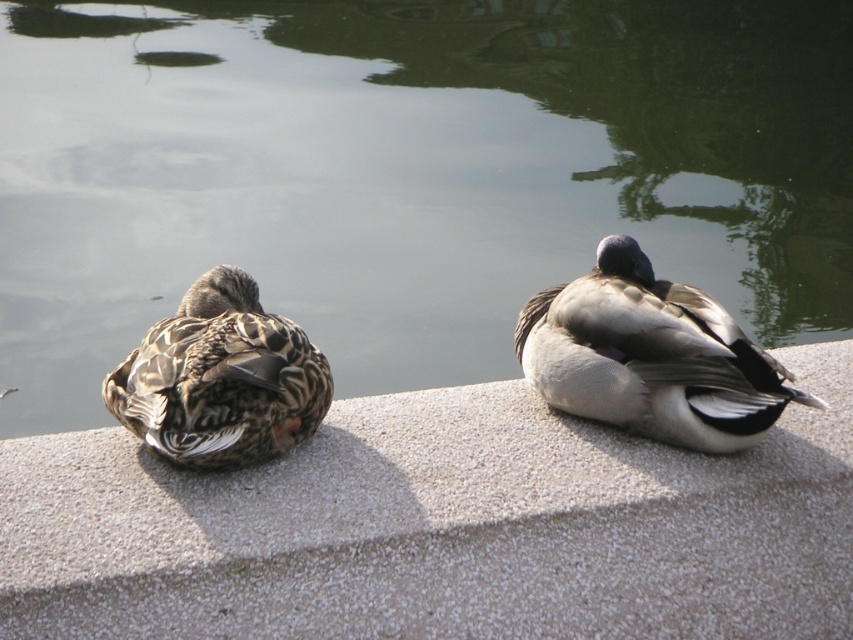
Based on the photo, does green smooth water at center have a smaller size compared to gray textured concrete at center?

Correct, green smooth water at center occupies less space than gray textured concrete at center.

Does green smooth water at center appear under gray textured concrete at center?

Actually, green smooth water at center is above gray textured concrete at center.

Identify the location of green smooth water at center. Image resolution: width=853 pixels, height=640 pixels. (407, 172).

The width and height of the screenshot is (853, 640). Find the location of `green smooth water at center`. green smooth water at center is located at coordinates (407, 172).

Between green smooth water at center and gray matte duck at center, which one is positioned lower?

green smooth water at center

Measure the distance between green smooth water at center and gray matte duck at center.

8.70 feet

Where is `green smooth water at center`? green smooth water at center is located at coordinates (407, 172).

At what (x,y) coordinates should I click in order to perform the action: click on green smooth water at center. Please return your answer as a coordinate pair (x, y). Looking at the image, I should click on (407, 172).

What are the coordinates of `gray textured concrete at center` in the screenshot? It's located at (440, 529).

At what (x,y) coordinates should I click in order to perform the action: click on gray textured concrete at center. Please return your answer as a coordinate pair (x, y). The image size is (853, 640). Looking at the image, I should click on (440, 529).